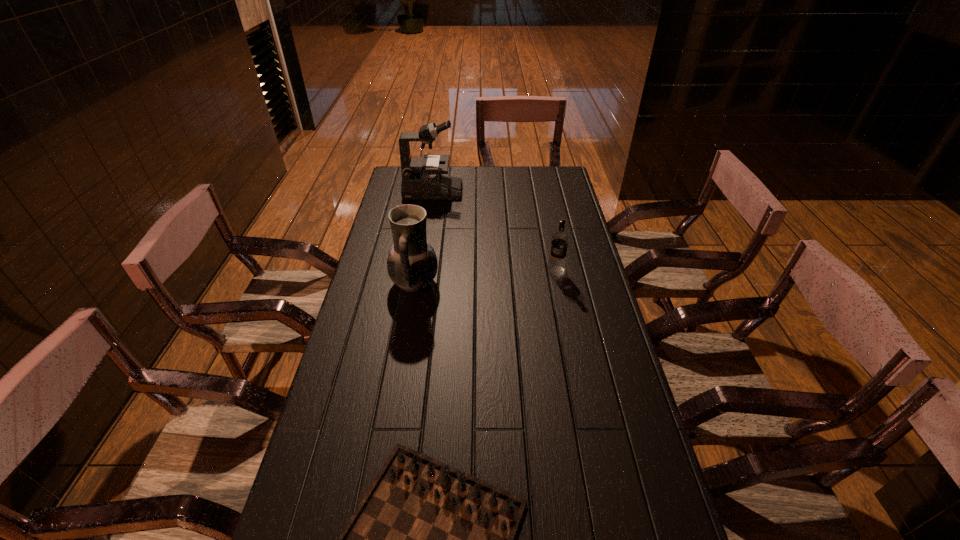
What are the coordinates of `object that is the closest to the pitcher` in the screenshot? It's located at (559, 240).

Where is `vacant point that satisfies the following two spatial constraints: 1. on the label of the second shortest object; 2. on the front-facing side of the pitcher`? The image size is (960, 540). vacant point that satisfies the following two spatial constraints: 1. on the label of the second shortest object; 2. on the front-facing side of the pitcher is located at coordinates (558, 283).

Identify the location of vacant space that satisfies the following two spatial constraints: 1. on the label of the rightmost object; 2. on the front-facing side of the pitcher. (558, 283).

This screenshot has width=960, height=540. In order to click on vacant space that satisfies the following two spatial constraints: 1. on the label of the rightmost object; 2. on the front-facing side of the pitcher in this screenshot , I will do `click(558, 283)`.

This screenshot has width=960, height=540. In order to click on free region that satisfies the following two spatial constraints: 1. on the label of the vodka; 2. on the front-facing side of the pitcher in this screenshot , I will do `click(558, 283)`.